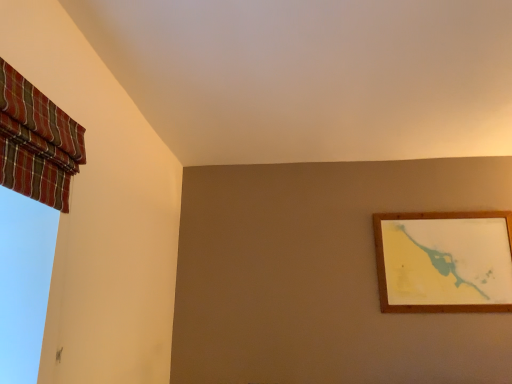
Where is `plaid fabric curtain at upper left`? Image resolution: width=512 pixels, height=384 pixels. plaid fabric curtain at upper left is located at coordinates (37, 142).

What do you see at coordinates (37, 142) in the screenshot? This screenshot has width=512, height=384. I see `plaid fabric curtain at upper left` at bounding box center [37, 142].

Find the location of a particular element. plaid fabric curtain at upper left is located at coordinates (37, 142).